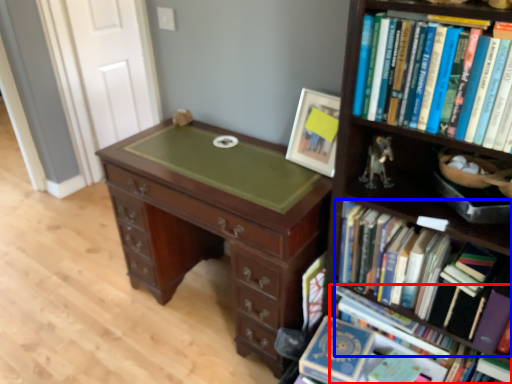
Question: Which point is closer to the camera, book (highlighted by a red box) or book (highlighted by a blue box)?

Choices:
 (A) book
 (B) book

Answer: (B)